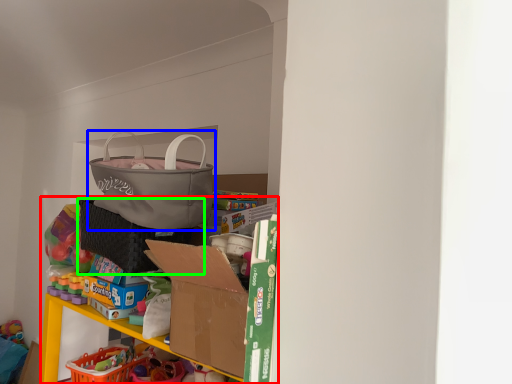
Question: Which object is positioned farthest from bookshelf (highlighted by a red box)? Select from handbag (highlighted by a blue box) and laundry basket (highlighted by a green box).

Choices:
 (A) handbag
 (B) laundry basket

Answer: (A)